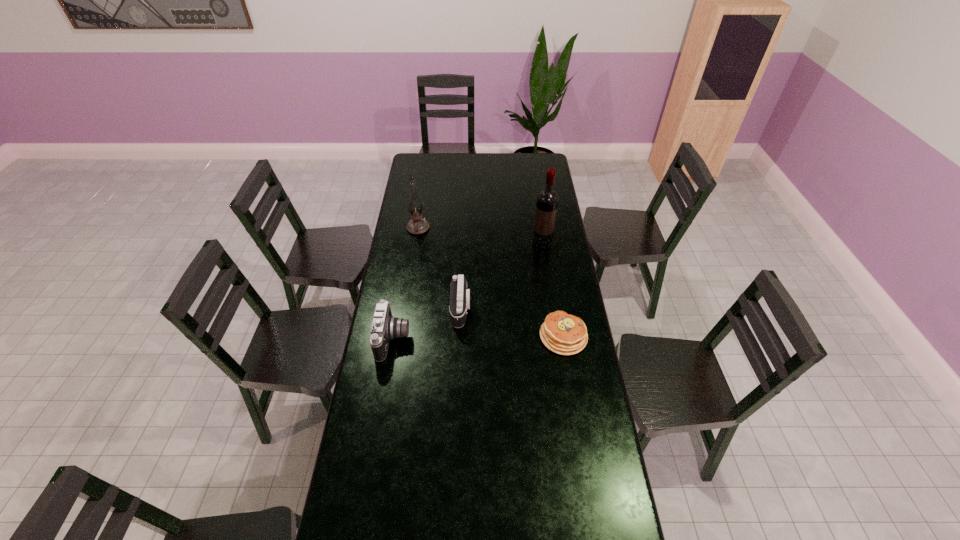
Identify the location of the fourth nearest object. (547, 200).

Identify the location of wine bottle. (547, 200).

The height and width of the screenshot is (540, 960). I want to click on the farthest object, so click(417, 225).

Where is `the fourth shortest object`? Image resolution: width=960 pixels, height=540 pixels. the fourth shortest object is located at coordinates 417,225.

Where is `the left camera`? The height and width of the screenshot is (540, 960). the left camera is located at coordinates (385, 327).

Locate an element on the screen. the right camera is located at coordinates (460, 297).

The height and width of the screenshot is (540, 960). What are the coordinates of `the shortest object` in the screenshot? It's located at (564, 334).

Identify the location of vacant space situated 0.060m on the left of the tallest object. Image resolution: width=960 pixels, height=540 pixels. (520, 244).

This screenshot has width=960, height=540. Identify the location of vacant space positioned on the back of the second tallest object. (425, 178).

The image size is (960, 540). I want to click on free region located on the front-facing side of the left camera, so click(x=454, y=339).